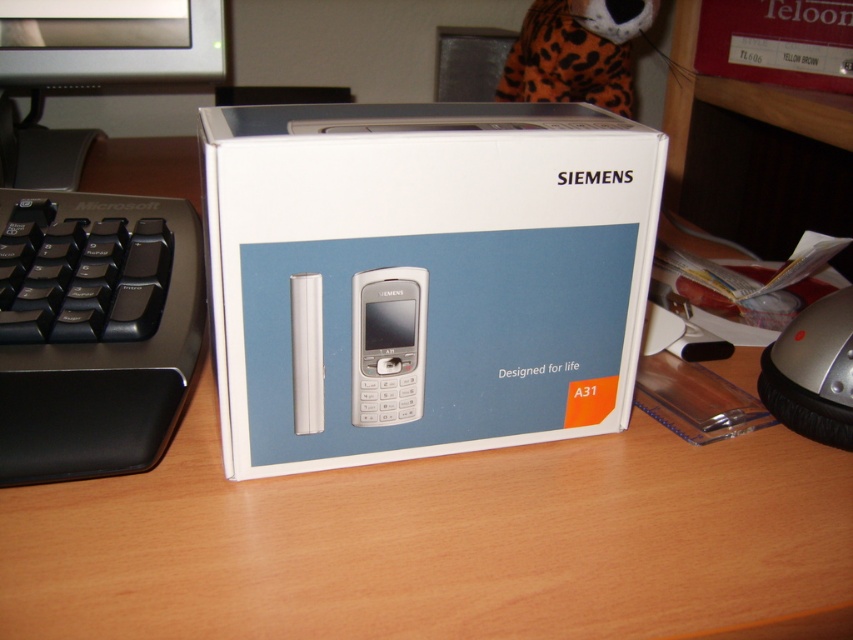
In the scene shown: Is black plastic keyboard at left below silver metallic phone at center?

No.

Who is higher up, black plastic keyboard at left or silver metallic phone at center?

Positioned higher is black plastic keyboard at left.

Describe the element at coordinates (94, 330) in the screenshot. I see `black plastic keyboard at left` at that location.

Where is `black plastic keyboard at left`? Image resolution: width=853 pixels, height=640 pixels. black plastic keyboard at left is located at coordinates (94, 330).

Does black plastic monitor at upper left appear on the left side of matte silver monitor at upper left?

Indeed, black plastic monitor at upper left is positioned on the left side of matte silver monitor at upper left.

Is black plastic monitor at upper left above matte silver monitor at upper left?

Actually, black plastic monitor at upper left is below matte silver monitor at upper left.

What do you see at coordinates (93, 67) in the screenshot? Image resolution: width=853 pixels, height=640 pixels. I see `black plastic monitor at upper left` at bounding box center [93, 67].

At what (x,y) coordinates should I click in order to perform the action: click on black plastic monitor at upper left. Please return your answer as a coordinate pair (x, y). The height and width of the screenshot is (640, 853). Looking at the image, I should click on (93, 67).

Identify the location of matte silver monitor at upper left. Image resolution: width=853 pixels, height=640 pixels. (109, 42).

Does point (83, 17) come farther from viewer compared to point (386, 397)?

Yes, it is behind point (386, 397).

I want to click on matte silver monitor at upper left, so click(109, 42).